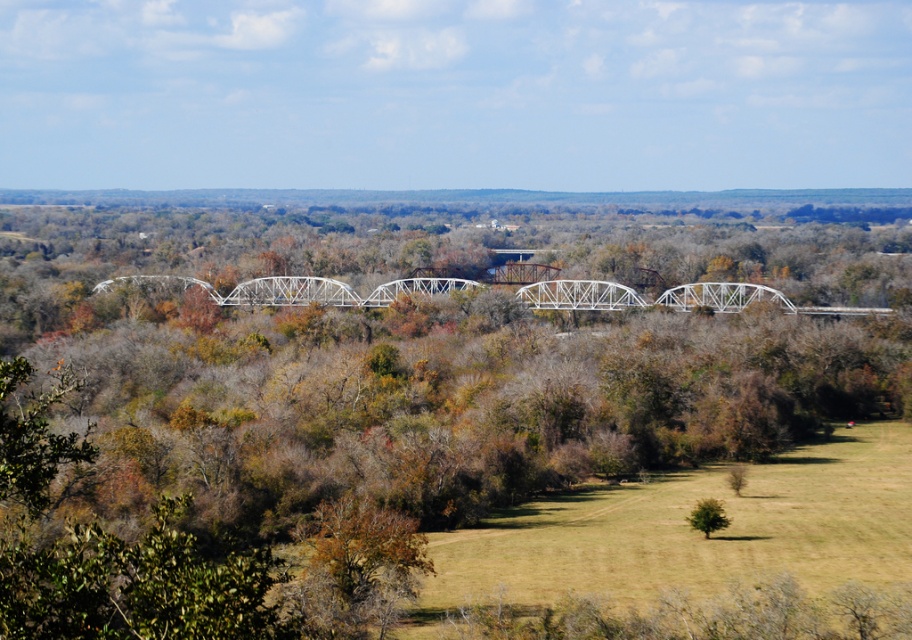
You are standing on the left side of the white metallic bridge at center. Looking towards the green matte tree at center, which direction should you walk to reach it?

Since the white metallic bridge at center is to the left of the green matte tree at center, you should walk to the right to reach the tree.

You are standing on the bridge and looking down. Which object, the green leafy tree at center or the green grassy field at lower right, appears larger in the image?

The green leafy tree at center appears larger because it is much taller than the green grassy field at lower right.

You are standing on the bridge and looking towards the valley. Which object is closer to you, the green leafy tree at center or the green grassy field at lower right?

The green leafy tree at center is closer to you since it is positioned in front of the green grassy field at lower right.